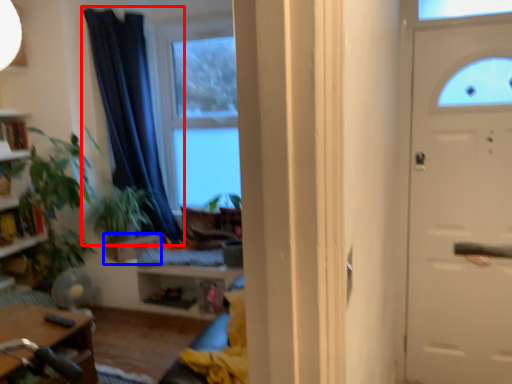
Question: Which point is further to the camera, curtain (highlighted by a red box) or drawer (highlighted by a blue box)?

Choices:
 (A) curtain
 (B) drawer

Answer: (B)